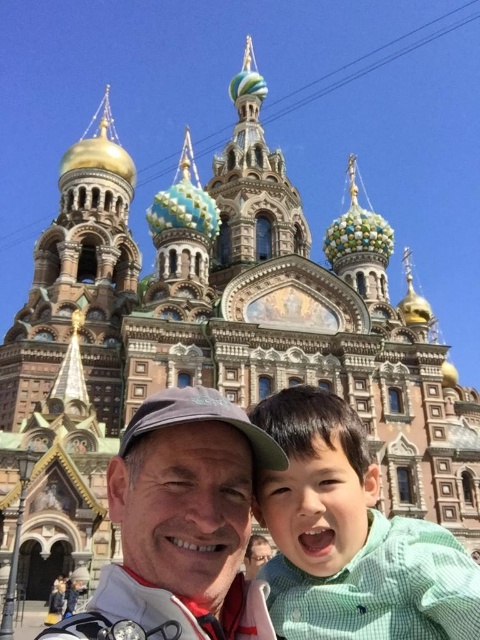
You are a photographer trying to capture a closeup shot of the green textured shirt at center and the matte gray cap at center. Which object should you zoom in on more to ensure both fit in the frame?

Since the green textured shirt at center is narrower than the matte gray cap at center, you should zoom in more on the matte gray cap at center to ensure both fit in the frame.

You are an artist planning to paint the scene. You want to ensure the green textured shirt at center and the matte gray cap at center are proportionally accurate. Which object should you paint smaller to maintain the correct size relationship?

The green textured shirt at center should be painted smaller than the matte gray cap at center to maintain the correct size relationship.